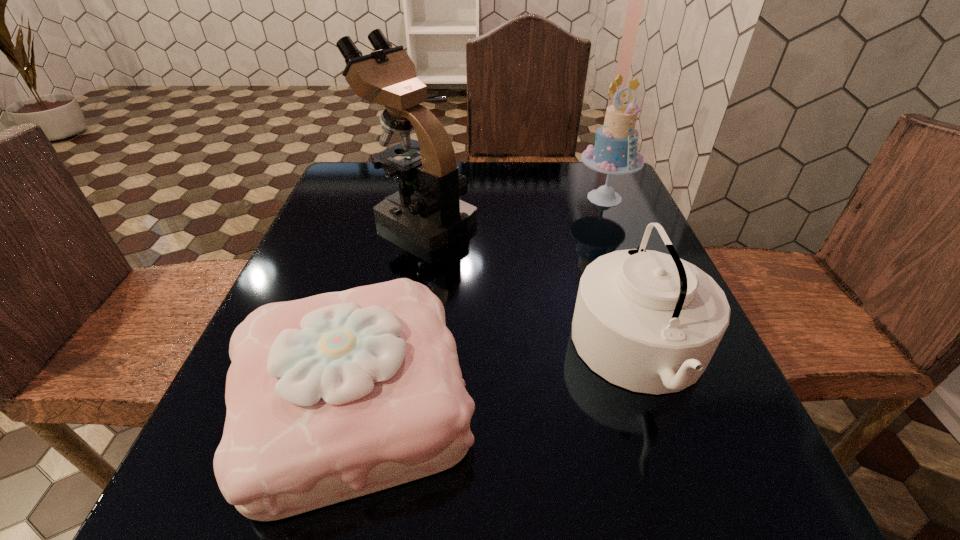
Locate an element on the screen. Image resolution: width=960 pixels, height=540 pixels. microscope is located at coordinates (427, 211).

The height and width of the screenshot is (540, 960). I want to click on the taller cake, so tap(615, 152).

Where is `the second tallest object`? This screenshot has height=540, width=960. the second tallest object is located at coordinates (615, 152).

Locate an element on the screen. Image resolution: width=960 pixels, height=540 pixels. the second shortest object is located at coordinates (650, 322).

The image size is (960, 540). I want to click on the left cake, so click(x=331, y=397).

Where is `the shorter cake`? Image resolution: width=960 pixels, height=540 pixels. the shorter cake is located at coordinates (331, 397).

This screenshot has width=960, height=540. What are the coordinates of `free region located 0.170m on the front of the tallest object` in the screenshot? It's located at (403, 309).

Locate an element on the screen. Image resolution: width=960 pixels, height=540 pixels. free space located 0.110m with a ladder on the side of the third shortest object is located at coordinates (622, 241).

I want to click on free region located 0.300m on the spout of the third tallest object, so click(x=391, y=353).

I want to click on vacant space located 0.080m on the spout of the third tallest object, so click(525, 353).